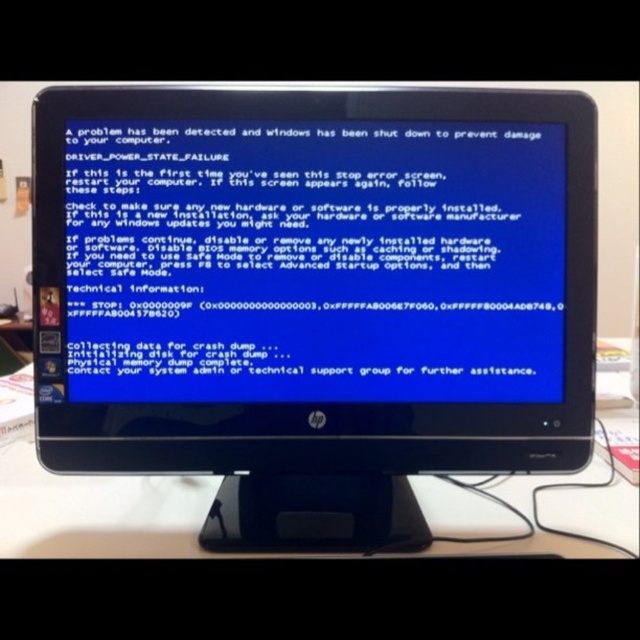
Identify the location of black plastic monitor at center. (314, 296).

Who is shorter, black plastic monitor at center or white plastic table at lower center?

white plastic table at lower center is shorter.

Is point (330, 298) positioned behind point (112, 500)?

No, it is not.

Locate an element on the screen. Image resolution: width=640 pixels, height=640 pixels. black plastic monitor at center is located at coordinates (314, 296).